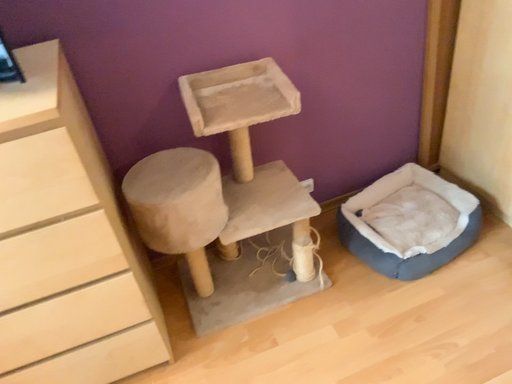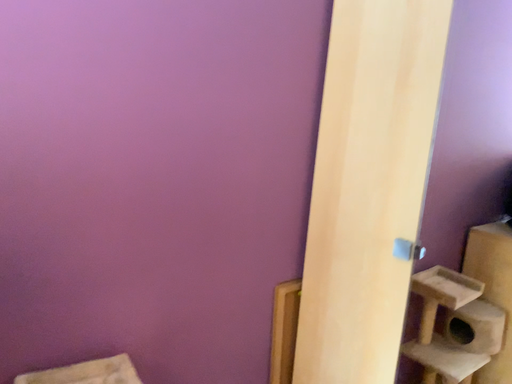
Question: Which way did the camera rotate in the video?

Choices:
 (A) rotated left
 (B) rotated right

Answer: (B)